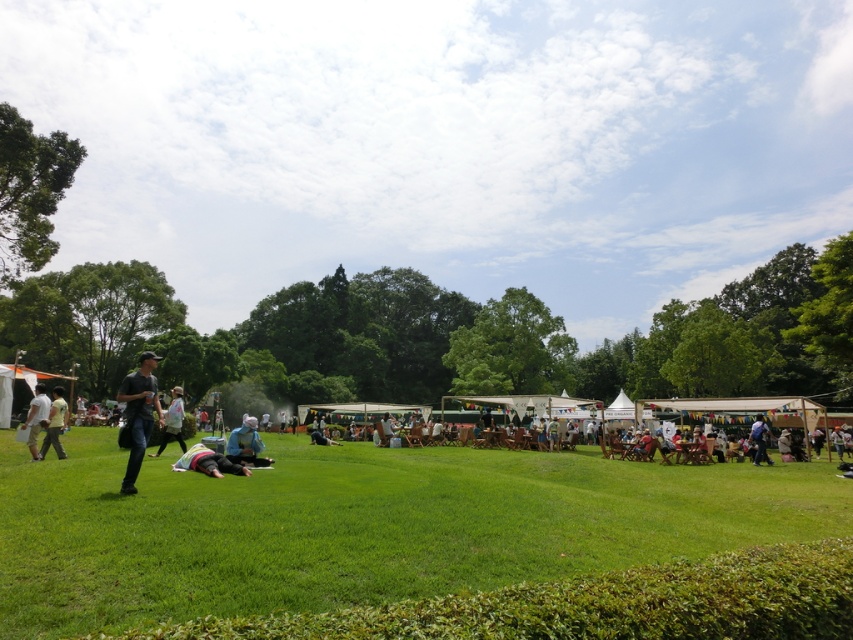
Can you confirm if blue fabric at center is positioned to the left of light blue denim jacket at center?

In fact, blue fabric at center is to the right of light blue denim jacket at center.

Who is lower down, blue fabric at center or light blue denim jacket at center?

Positioned lower is blue fabric at center.

Does point (254, 458) lie behind point (178, 445)?

That is False.

Identify the location of blue fabric at center. (247, 444).

Consider the image. Between light blue fabric at center and dark gray jeans at lower left, which one has more height?

dark gray jeans at lower left

How far apart are light blue fabric at center and dark gray jeans at lower left?

light blue fabric at center is 5.45 meters away from dark gray jeans at lower left.

Is point (236, 472) farther from viewer compared to point (50, 406)?

No, it is not.

The width and height of the screenshot is (853, 640). What are the coordinates of `light blue fabric at center` in the screenshot? It's located at (207, 461).

What do you see at coordinates (363, 525) in the screenshot?
I see `green grassy field at center` at bounding box center [363, 525].

Who is shorter, green grassy field at center or white cotton shirt at left?

Standing shorter between the two is green grassy field at center.

Who is more distant from viewer, (x=314, y=468) or (x=28, y=404)?

Point (x=28, y=404)

Where is `green grassy field at center`? green grassy field at center is located at coordinates (363, 525).